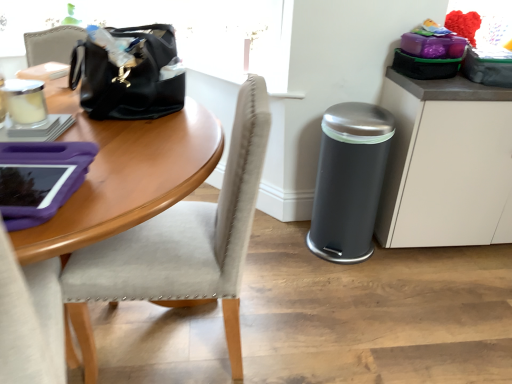
Question: In terms of size, does light gray fabric chair at left appear bigger or smaller than matte gray cabinet at right?

Choices:
 (A) small
 (B) big

Answer: (A)

Question: Which is correct: light gray fabric chair at left is inside matte gray cabinet at right, or outside of it?

Choices:
 (A) outside
 (B) inside

Answer: (A)

Question: Estimate the real-world distances between objects in this image. Which object is farther from the black leather handbag at upper left?

Choices:
 (A) light gray fabric chair at left
 (B) matte gray cabinet at right

Answer: (B)

Question: Estimate the real-world distances between objects in this image. Which object is closer to the matte gray cabinet at right?

Choices:
 (A) light gray fabric chair at left
 (B) black leather handbag at upper left

Answer: (A)